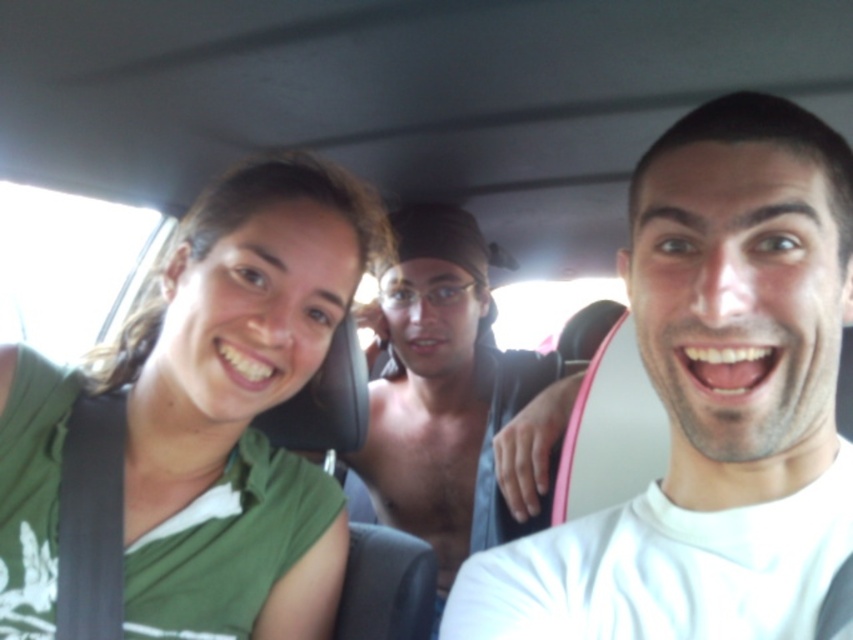
You are sitting in the back seat of the car and want to hand a snack to the person wearing the white matte shirt at center and the shiny black shirt at center. Which one is closer to you?

The white matte shirt at center is closer to you because it is in front of the shiny black shirt at center, meaning the white matte shirt at center is nearer to your position in the back seat.

You are sitting in the back seat of the car and want to hand a snack to the person wearing the white matte shirt at center and the green matte shirt at left. Which one is closer to your left side?

The green matte shirt at left is closer to your left side because the white matte shirt at center is positioned on the right side of it.